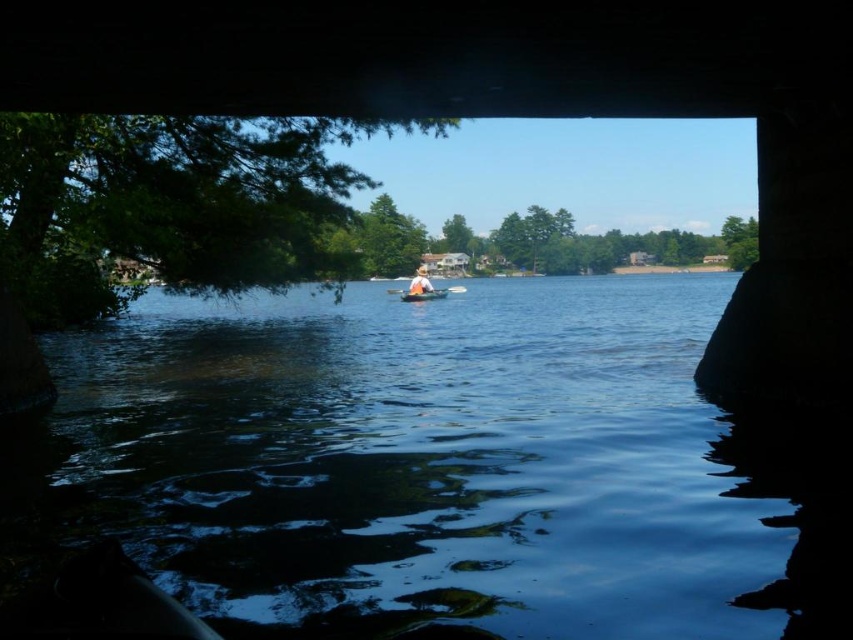
Looking at this image, which of these two, orange fabric boat at center or orange plastic paddle at center, stands shorter?

orange fabric boat at center is shorter.

Is point (427, 294) behind point (450, 285)?

That is False.

The width and height of the screenshot is (853, 640). Find the location of `orange fabric boat at center`. orange fabric boat at center is located at coordinates 422,294.

This screenshot has height=640, width=853. What are the coordinates of `orange fabric boat at center` in the screenshot? It's located at (422, 294).

Between blue water at center and orange plastic paddle at center, which one is positioned higher?

orange plastic paddle at center is higher up.

The width and height of the screenshot is (853, 640). What are the coordinates of `blue water at center` in the screenshot? It's located at (439, 467).

Can you confirm if blue water at center is positioned to the left of orange fabric boat at center?

In fact, blue water at center is to the right of orange fabric boat at center.

Is blue water at center in front of orange fabric boat at center?

Yes, it is in front of orange fabric boat at center.

I want to click on blue water at center, so click(x=439, y=467).